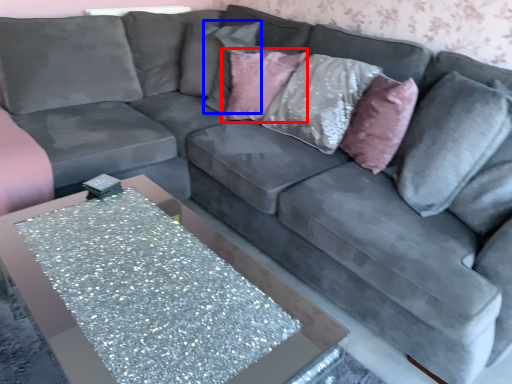
Question: Which of the following is the farthest to the observer, pillow (highlighted by a red box) or pillow (highlighted by a blue box)?

Choices:
 (A) pillow
 (B) pillow

Answer: (B)